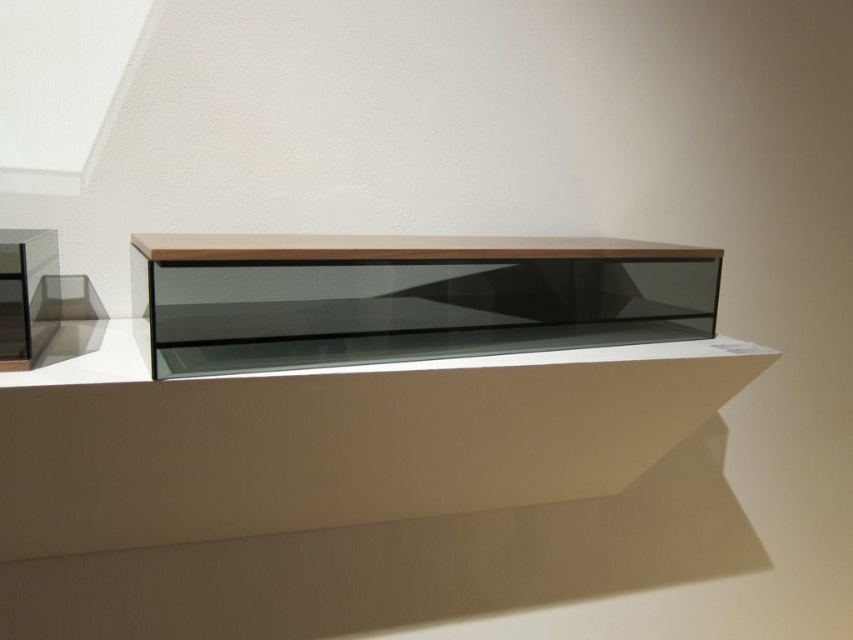
You are arranging a vase on the white matte ledge at center and a sculpture on the matte wood shelf at center. Which object will be placed more to the left?

The white matte ledge at center is positioned on the left side of the matte wood shelf at center, so the vase on the white matte ledge at center will be placed more to the left.

You are placing a decorative item on the white matte ledge at center. The item requires a minimum of 24 inches of space. Can the ledge accommodate the item?

The white matte ledge at center has a space of 25.09 inches, which is more than the required 24 inches, so it can accommodate the item.

You are standing in front of the minimalist display setup and want to place a small sculpture on the white matte ledge at center. If your hand is 24 inches away from the ledge, can you comfortably reach it without moving closer?

The white matte ledge at center is 25.09 inches away from the viewer. Since your hand is only 24 inches away, you are slightly too far to comfortably reach it without moving closer.